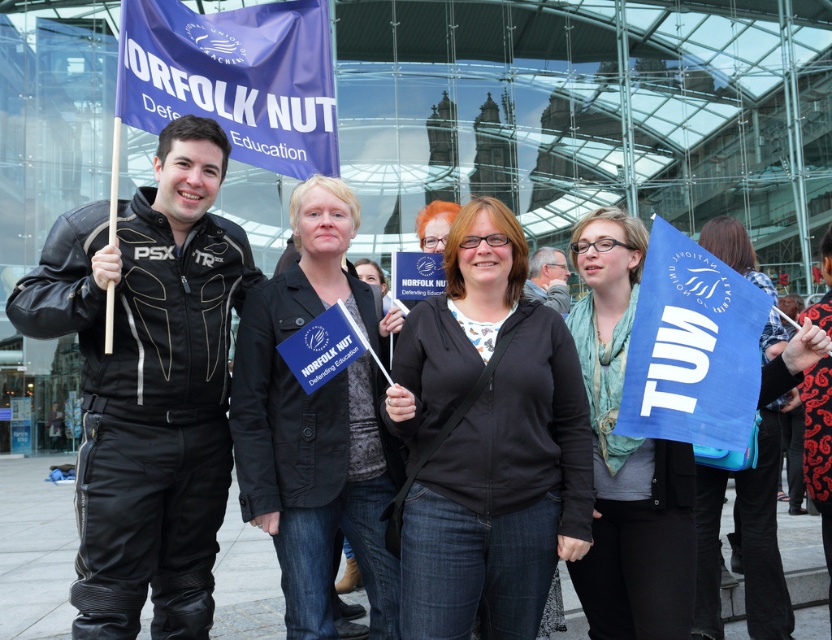
Locate an element on the screen. black leather jacket at center is located at coordinates (315, 426).

Who is more forward, (276, 442) or (746, 248)?

Positioned in front is point (276, 442).

Is point (275, 474) in front of point (761, 340)?

Yes, it is.

Locate an element on the screen. black leather jacket at center is located at coordinates (315, 426).

From the picture: Between black fabric jacket at center and black leather jacket at center, which one has more height?

Standing taller between the two is black fabric jacket at center.

Which of these two, black fabric jacket at center or black leather jacket at center, stands shorter?

Standing shorter between the two is black leather jacket at center.

Which is behind, point (419, 625) or point (301, 241)?

Point (301, 241)

Identify the location of black fabric jacket at center. The width and height of the screenshot is (832, 640). (488, 442).

Does black fabric jacket at center have a greater height compared to blue fabric scarf at center?

Incorrect, black fabric jacket at center's height is not larger of blue fabric scarf at center's.

Which is behind, point (537, 524) or point (607, 278)?

The point (607, 278) is more distant.

The width and height of the screenshot is (832, 640). Find the location of `black fabric jacket at center`. black fabric jacket at center is located at coordinates (488, 442).